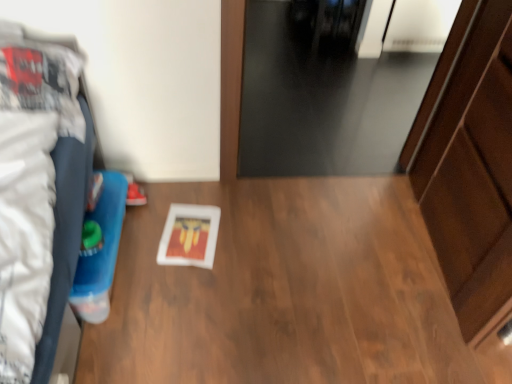
Image resolution: width=512 pixels, height=384 pixels. Identify the location of black glass door at upper center. (333, 88).

Describe the element at coordinates (135, 195) in the screenshot. I see `matte red shoe at lower left` at that location.

Describe the element at coordinates (282, 291) in the screenshot. I see `wooden table at center` at that location.

Where is `black glass door at upper center`? This screenshot has width=512, height=384. black glass door at upper center is located at coordinates (333, 88).

Is wooden dresser at right beside black glass door at upper center?

No, wooden dresser at right is not making contact with black glass door at upper center.

Considering the sizes of objects wooden dresser at right and black glass door at upper center in the image provided, who is bigger, wooden dresser at right or black glass door at upper center?

wooden dresser at right is bigger.

Is wooden dresser at right oriented away from black glass door at upper center?

No, wooden dresser at right is not facing the opposite direction of black glass door at upper center.

From the image's perspective, is wooden dresser at right below black glass door at upper center?

Yes, from the image's perspective, wooden dresser at right is below black glass door at upper center.

From a real-world perspective, who is located higher, wooden dresser at right or wooden table at center?

In real-world perspective, wooden dresser at right is above.

From the image's perspective, is wooden dresser at right positioned above or below wooden table at center?

From the image's perspective, wooden dresser at right appears above wooden table at center.

Is wooden dresser at right at the right side of wooden table at center?

Correct, you'll find wooden dresser at right to the right of wooden table at center.

Is wooden dresser at right positioned with its back to wooden table at center?

No, wooden dresser at right is not facing the opposite direction of wooden table at center.

Who is shorter, wooden dresser at right or matte red shoe at lower left?

matte red shoe at lower left.

Looking at the image, does wooden dresser at right seem bigger or smaller compared to matte red shoe at lower left?

In the image, wooden dresser at right appears to be larger than matte red shoe at lower left.

You are a GUI agent. You are given a task and a screenshot of the screen. Output one action in this format:
    pyautogui.click(x=<x>, y=<y>)
    Task: Click on the footwear on the left of wooden dresser at right
    The height and width of the screenshot is (384, 512).
    Given the screenshot: What is the action you would take?
    pyautogui.click(x=135, y=195)

Do you think wooden dresser at right is within matte red shoe at lower left, or outside of it?

wooden dresser at right is not inside matte red shoe at lower left, it's outside.

Considering the positions of points (263, 172) and (313, 321), is point (263, 172) closer to camera compared to point (313, 321)?

No, it is behind (313, 321).

Can you confirm if black glass door at upper center is positioned to the left of wooden table at center?

Incorrect, black glass door at upper center is not on the left side of wooden table at center.

Considering the positions of objects black glass door at upper center and wooden table at center in the image provided, who is behind, black glass door at upper center or wooden table at center?

black glass door at upper center is further away from the camera.

Can you confirm if black glass door at upper center is smaller than wooden table at center?

Indeed, black glass door at upper center has a smaller size compared to wooden table at center.

Does point (339, 219) appear closer or farther from the camera than point (456, 288)?

Point (339, 219) appears to be farther away from the viewer than point (456, 288).

Is wooden table at center taller or shorter than wooden dresser at right?

In the image, wooden table at center appears to be shorter than wooden dresser at right.

Is wooden table at center turned away from wooden dresser at right?

No, wooden table at center is not facing away from wooden dresser at right.

In the image, is wooden table at center positioned in front of or behind wooden dresser at right?

Visually, wooden table at center is located behind wooden dresser at right.

Can you confirm if wooden table at center is positioned to the right of black glass door at upper center?

No.

From a real-world perspective, which object stands above the other?

wooden table at center, from a real-world perspective.

What's the angular difference between wooden table at center and black glass door at upper center's facing directions?

They differ by 180 degrees in their facing directions.

Considering the relative sizes of wooden table at center and black glass door at upper center in the image provided, is wooden table at center shorter than black glass door at upper center?

No, wooden table at center is not shorter than black glass door at upper center.

Does black glass door at upper center touch matte red shoe at lower left?

No, black glass door at upper center is not beside matte red shoe at lower left.

Is black glass door at upper center not within matte red shoe at lower left?

Yes, black glass door at upper center is not within matte red shoe at lower left.

From the image's perspective, is black glass door at upper center above or below matte red shoe at lower left?

From the image's perspective, black glass door at upper center appears above matte red shoe at lower left.

Where is `dresser below the black glass door at upper center (from the image's perspective)`? Image resolution: width=512 pixels, height=384 pixels. dresser below the black glass door at upper center (from the image's perspective) is located at coordinates (473, 175).

This screenshot has width=512, height=384. What are the coordinates of `dresser on the right side of wooden table at center` in the screenshot? It's located at (473, 175).

When comparing their distances from matte red shoe at lower left, does wooden dresser at right or black glass door at upper center seem further?

black glass door at upper center.

Which object lies further to the anchor point wooden dresser at right, matte red shoe at lower left or black glass door at upper center?

Among the two, matte red shoe at lower left is located further to wooden dresser at right.

Estimate the real-world distances between objects in this image. Which object is closer to black glass door at upper center, wooden table at center or wooden dresser at right?

Based on the image, wooden table at center appears to be nearer to black glass door at upper center.

Estimate the real-world distances between objects in this image. Which object is closer to wooden dresser at right, wooden table at center or matte red shoe at lower left?

Among the two, wooden table at center is located nearer to wooden dresser at right.

From the image, which object appears to be nearer to black glass door at upper center, wooden dresser at right or wooden table at center?

wooden table at center is positioned closer to the anchor black glass door at upper center.

Looking at this image, when comparing their distances from black glass door at upper center, does matte red shoe at lower left or wooden table at center seem closer?

The object closer to black glass door at upper center is wooden table at center.

From the image, which object appears to be farther from matte red shoe at lower left, wooden dresser at right or wooden table at center?

wooden dresser at right is further to matte red shoe at lower left.

In the scene shown: From the image, which object appears to be nearer to matte red shoe at lower left, wooden table at center or wooden dresser at right?

The object closer to matte red shoe at lower left is wooden table at center.

The image size is (512, 384). What are the coordinates of `door between matte red shoe at lower left and wooden dresser at right` in the screenshot? It's located at (333, 88).

You are a GUI agent. You are given a task and a screenshot of the screen. Output one action in this format:
    pyautogui.click(x=<x>, y=<y>)
    Task: Click on the table between wooden dresser at right and black glass door at upper center along the z-axis
    
    Given the screenshot: What is the action you would take?
    pyautogui.click(x=282, y=291)

Identify the location of footwear between black glass door at upper center and wooden table at center vertically. This screenshot has width=512, height=384. (135, 195).

Identify the location of table between matte red shoe at lower left and wooden dresser at right. The image size is (512, 384). (282, 291).